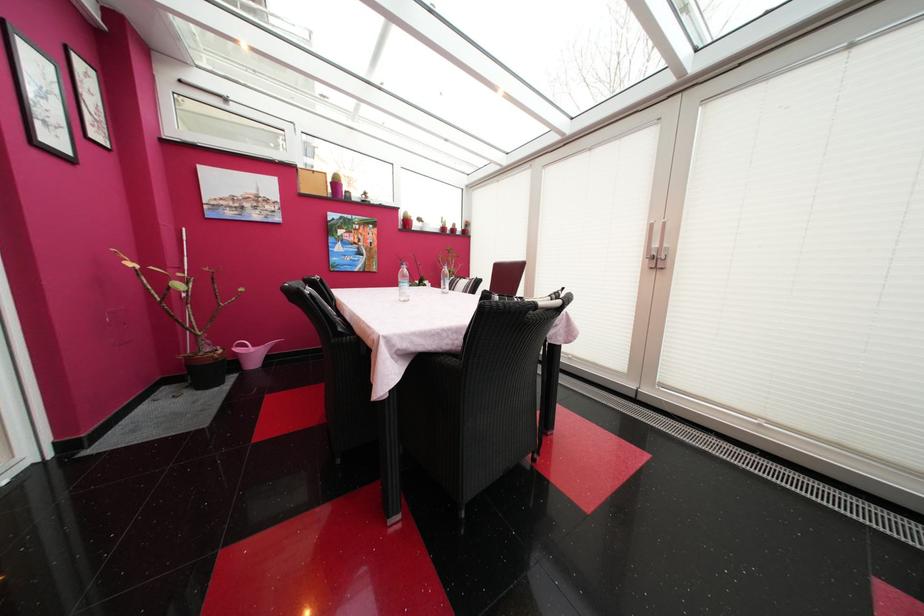
What do you see at coordinates (662, 246) in the screenshot? This screenshot has height=616, width=924. I see `the white door handle` at bounding box center [662, 246].